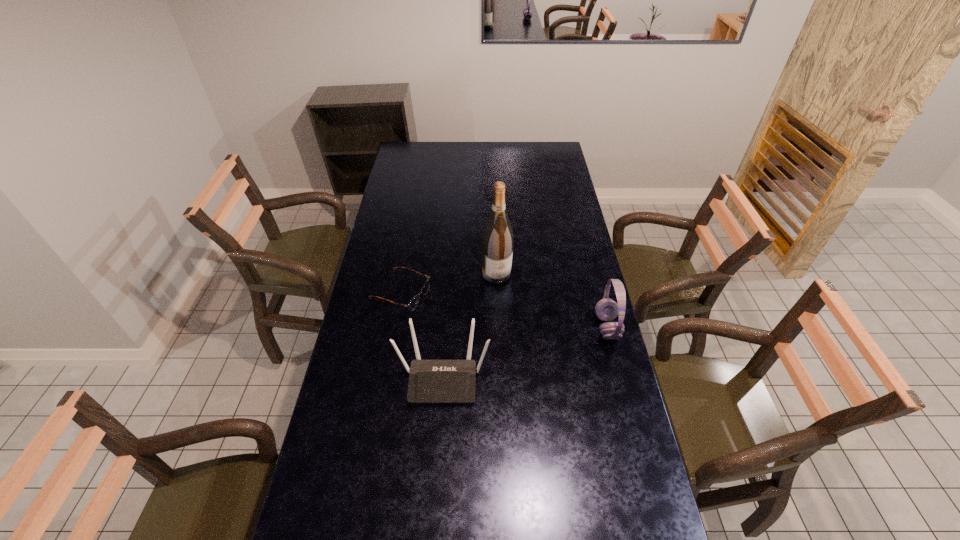
Locate an element on the screen. The height and width of the screenshot is (540, 960). vacant space located on the label of the wine bottle is located at coordinates (505, 293).

This screenshot has height=540, width=960. Find the location of `free point located 0.170m on the front-facing side of the shortest object`. free point located 0.170m on the front-facing side of the shortest object is located at coordinates (468, 318).

In order to click on vacant space located 0.090m on the front-facing side of the shortest object in this screenshot , I will do `click(448, 311)`.

Image resolution: width=960 pixels, height=540 pixels. In order to click on vacant region located 0.380m on the front-facing side of the shortest object in this screenshot , I will do `click(521, 338)`.

At what (x,y) coordinates should I click in order to perform the action: click on object that is at the left edge. Please return your answer as a coordinate pair (x, y). This screenshot has height=540, width=960. Looking at the image, I should click on (413, 303).

You are a GUI agent. You are given a task and a screenshot of the screen. Output one action in this format:
    pyautogui.click(x=<x>, y=<y>)
    Task: Click on the object present at the right edge
    
    Given the screenshot: What is the action you would take?
    pyautogui.click(x=606, y=309)

Where is `vacant space at the far edge`? vacant space at the far edge is located at coordinates (502, 161).

The width and height of the screenshot is (960, 540). Identify the location of vacant area at the near edge of the desktop. (542, 490).

This screenshot has height=540, width=960. In the image, there is a desktop. What are the coordinates of `free space at the left edge` in the screenshot? It's located at (408, 245).

At what (x,y) coordinates should I click in order to perform the action: click on blank space at the right edge of the desktop. Please return your answer as a coordinate pair (x, y). Image resolution: width=960 pixels, height=540 pixels. Looking at the image, I should click on (572, 279).